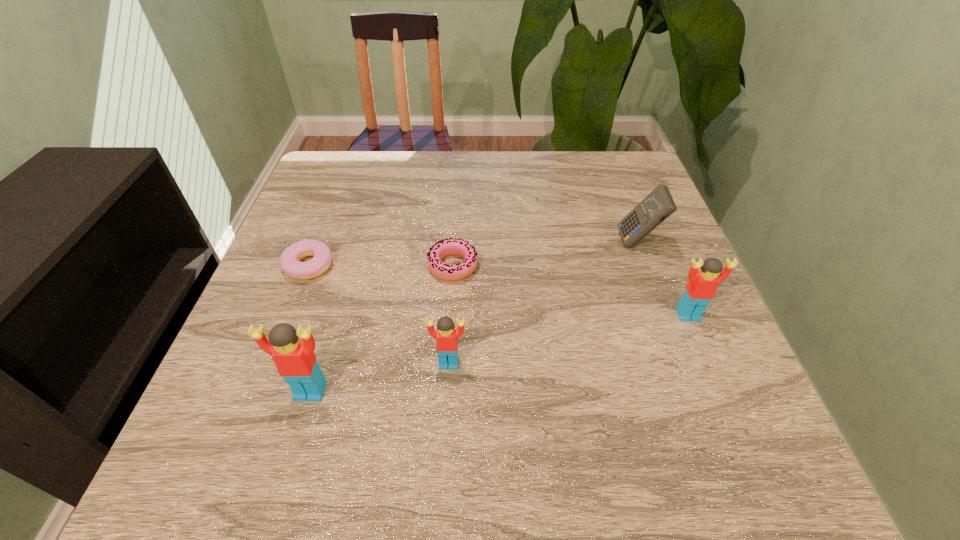
The height and width of the screenshot is (540, 960). Identify the location of free space located on the face of the third nearest object. (727, 406).

What are the coordinates of `free location located 0.290m on the left of the right doughnut` in the screenshot? It's located at (298, 266).

At what (x,y) coordinates should I click in order to perform the action: click on vacant region located on the back of the left doughnut. Please return your answer as a coordinate pair (x, y). Image resolution: width=960 pixels, height=540 pixels. Looking at the image, I should click on (329, 214).

Where is `free point located 0.380m on the front-facing side of the calculator`? The height and width of the screenshot is (540, 960). free point located 0.380m on the front-facing side of the calculator is located at coordinates (457, 242).

Where is `vacant area situated 0.400m on the front-facing side of the calculator`? The image size is (960, 540). vacant area situated 0.400m on the front-facing side of the calculator is located at coordinates (448, 242).

You are a GUI agent. You are given a task and a screenshot of the screen. Output one action in this format:
    pyautogui.click(x=<x>, y=<y>)
    Task: Click on the free region located on the front-facing side of the calculator
    The image size is (960, 540).
    Given the screenshot: What is the action you would take?
    pyautogui.click(x=448, y=242)

Identify the location of object located in the near edge section of the desktop. (294, 358).

Identify the location of Lego present at the left edge. The image size is (960, 540). (294, 358).

Locate an element on the screen. doughnut that is at the left edge is located at coordinates (290, 263).

At what (x,y) coordinates should I click in order to perform the action: click on Lego that is positioned at the right edge. Please return your answer as a coordinate pair (x, y). Looking at the image, I should click on (701, 288).